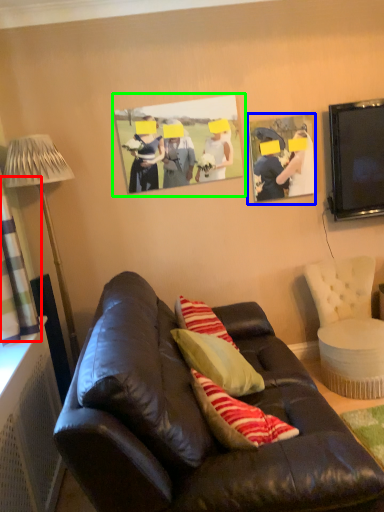
Question: Which is farther away from curtain (highlighted by a red box)? picture frame (highlighted by a blue box) or picture frame (highlighted by a green box)?

Choices:
 (A) picture frame
 (B) picture frame

Answer: (A)